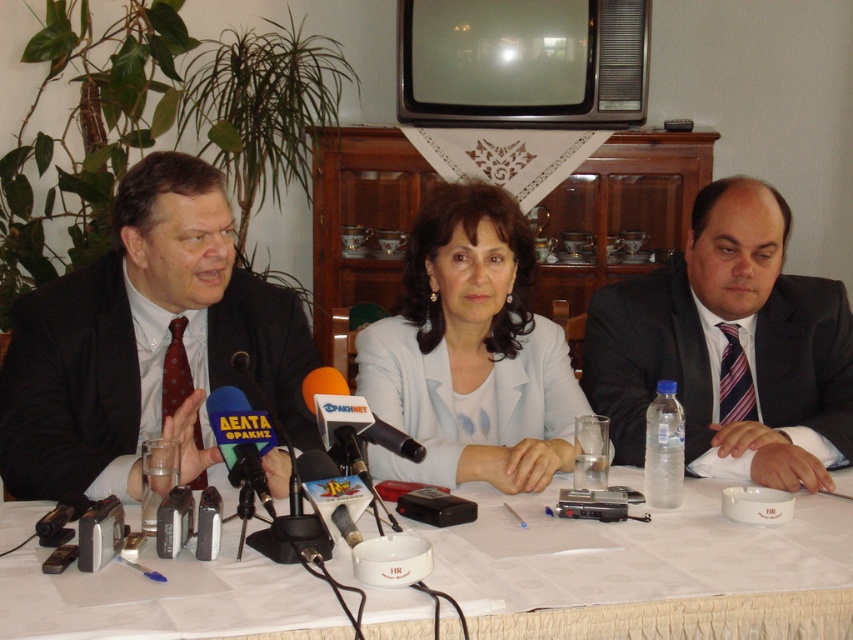
Question: Is white paper table at center wider than dark gray suit at right?

Choices:
 (A) no
 (B) yes

Answer: (B)

Question: Which point is closer to the camera?

Choices:
 (A) (776, 312)
 (B) (242, 616)
 (C) (0, 397)

Answer: (B)

Question: Is white matte jacket at center smaller than orange fabric microphone at center?

Choices:
 (A) no
 (B) yes

Answer: (A)

Question: Which object is closer to the camera taking this photo?

Choices:
 (A) white matte jacket at center
 (B) dark gray suit at right
 (C) matte black suit at left

Answer: (C)

Question: Is white paper table at center thinner than orange fabric microphone at center?

Choices:
 (A) yes
 (B) no

Answer: (B)

Question: Which point is farther to the camera?

Choices:
 (A) white matte jacket at center
 (B) matte black suit at left

Answer: (A)